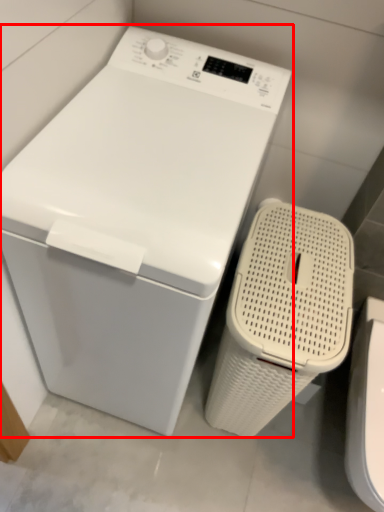
Question: From the image's perspective, where is washing machine (annotated by the red box) located relative to washer?

Choices:
 (A) above
 (B) below

Answer: (A)